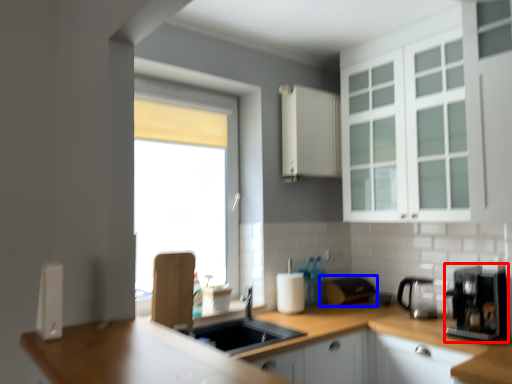
Question: Which of the following is the farthest to the observer, coffee machine (highlighted by a red box) or appliance (highlighted by a blue box)?

Choices:
 (A) coffee machine
 (B) appliance

Answer: (B)